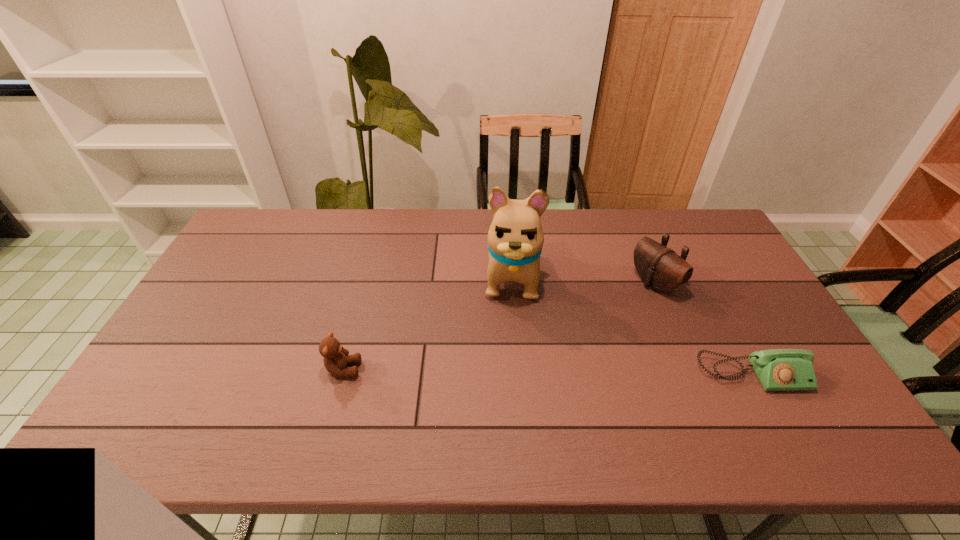
Identify the location of vacant area between the tallest object and the telephone. The image size is (960, 540). (632, 325).

Find the location of `free spot between the pouch and the second shortest object`. free spot between the pouch and the second shortest object is located at coordinates (499, 327).

Where is `free space that is in between the shortest object and the third tallest object`? This screenshot has width=960, height=540. free space that is in between the shortest object and the third tallest object is located at coordinates (547, 372).

At what (x,y) coordinates should I click in order to perform the action: click on object that ranks as the closest to the telephone. Please return your answer as a coordinate pair (x, y). The image size is (960, 540). Looking at the image, I should click on (660, 268).

Point out which object is positioned as the nearest to the leftmost object. Please provide its 2D coordinates. Your answer should be formatted as a tuple, i.e. [(x, y)], where the tuple contains the x and y coordinates of a point satisfying the conditions above.

[(515, 238)]